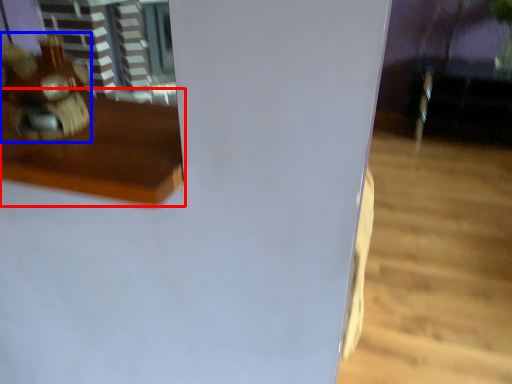
Question: Among these objects, which one is farthest to the camera, furniture (highlighted by a red box) or toy (highlighted by a blue box)?

Choices:
 (A) furniture
 (B) toy

Answer: (B)